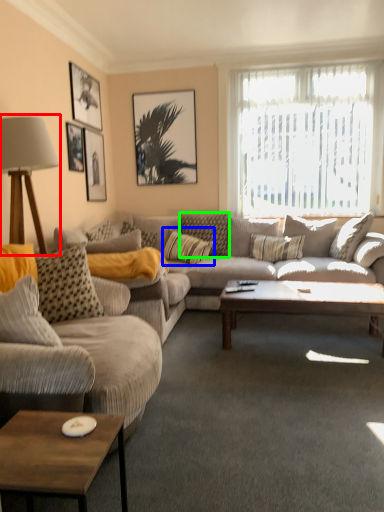
Question: Which object is positioned farthest from table lamp (highlighted by a red box)? Select from pillow (highlighted by a blue box) and pillow (highlighted by a green box).

Choices:
 (A) pillow
 (B) pillow

Answer: (B)